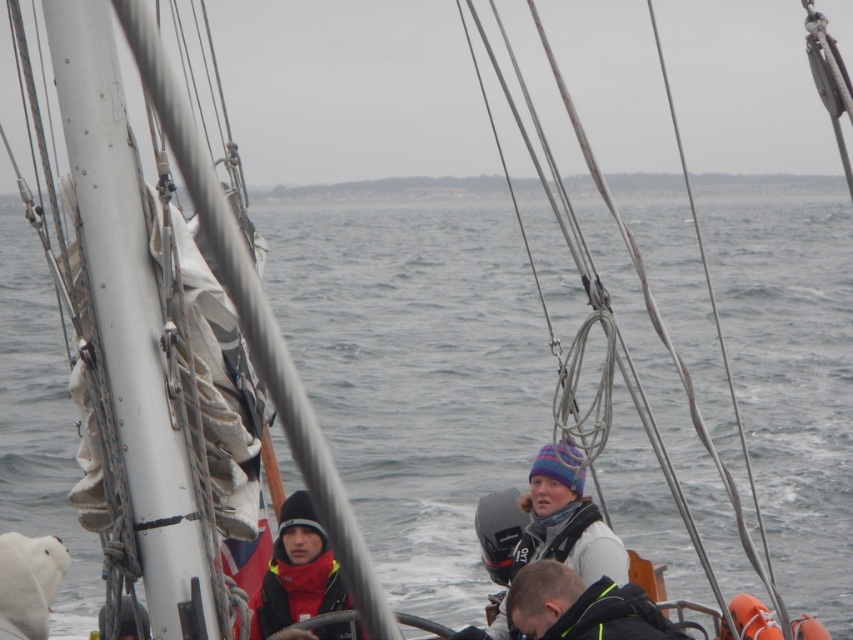
Consider the image. You are a photographer trying to capture a clear shot of both the striped knit hat at center and the red fleece jacket at lower left. Since you want to ensure both are visible in the frame, which object should you focus on first to account for their sizes?

The striped knit hat at center is larger in size compared to the red fleece jacket at lower left, so you should focus on the striped knit hat at center first to ensure its details are sharp before adjusting for the smaller red fleece jacket at lower left.

You are standing on the deck of the boat and need to hand a life vest to someone. The dark brown leather jacket at lower center and the red fleece jacket at lower left are both nearby. Which person is closer to you?

The dark brown leather jacket at lower center is 2.24 meters away from the red fleece jacket at lower left. Since the question asks which is closer, but the distance between them is given, but the user is at an unknown position. Wait, the problem states that both are nearby, but the distance between them is 2.24 meters. However, without knowing the observer position, can we determine which is closer? Hmm, maybe the question is flawed. Alternatively, perhaps the question assumes the observer is at a point, e

In the scene shown: You are a safety inspector on the boat and need to ensure that the distance between the striped knit hat at center and the red fleece jacket at lower left is within the recommended 36 inches for safety protocols. Is the current distance compliant?

The distance between the striped knit hat at center and the red fleece jacket at lower left is 37.37 inches, which exceeds the recommended 36 inches for safety protocols. Therefore, it is not compliant.